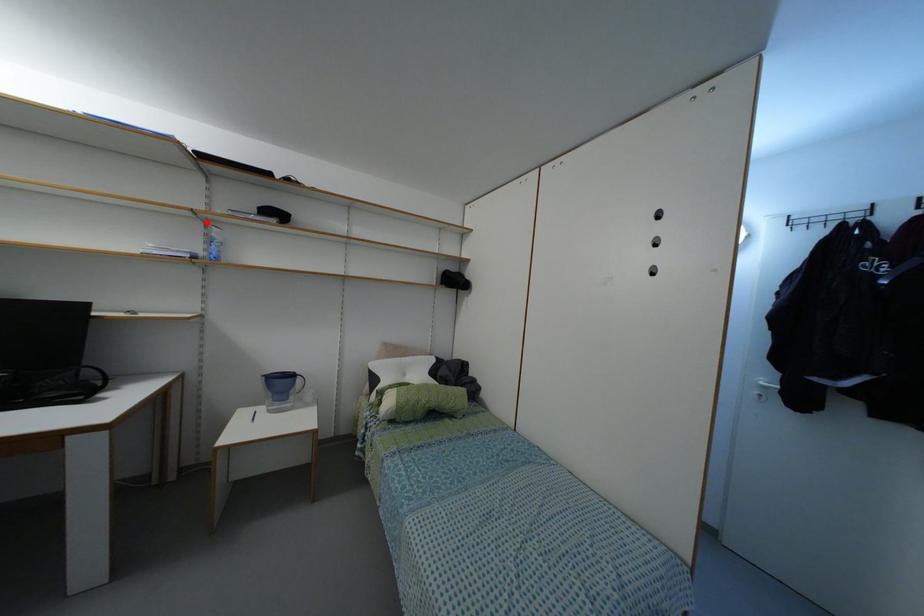
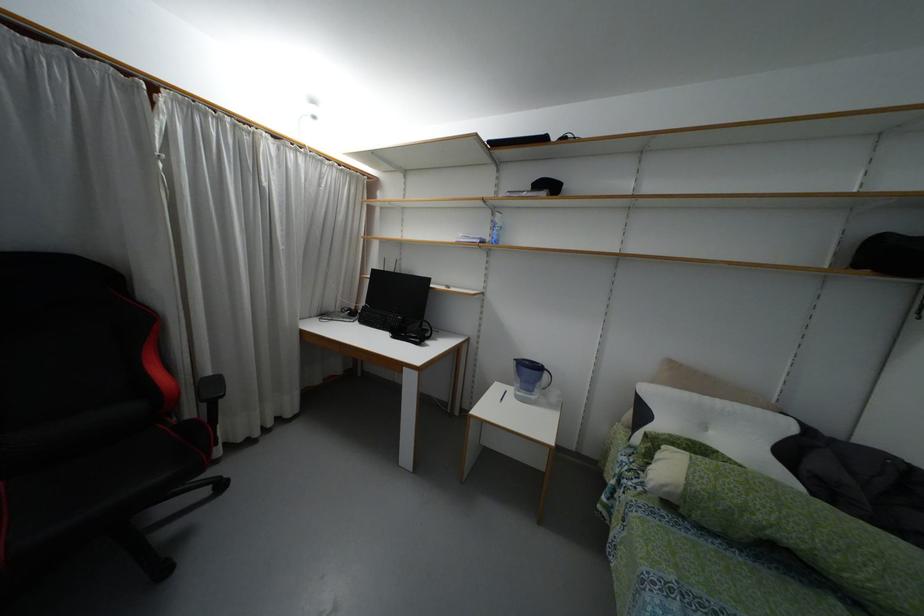
Where in the second image is the point corresponding to the highlighted location from the first image?

(493, 209)